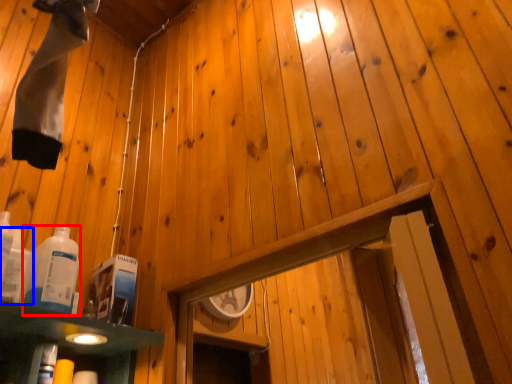
Question: Among these objects, which one is nearest to the camera, bottle (highlighted by a red box) or bottle (highlighted by a blue box)?

Choices:
 (A) bottle
 (B) bottle

Answer: (B)